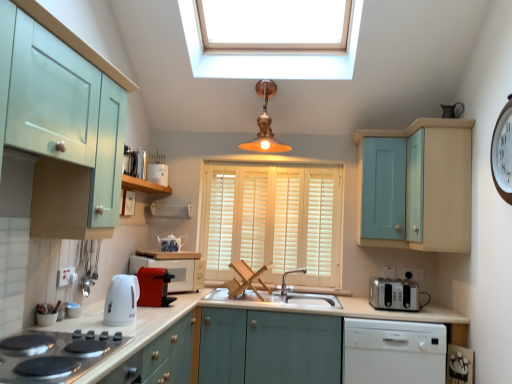
The width and height of the screenshot is (512, 384). I want to click on free space that is to the left of white glossy electric kettle at lower left, so click(x=84, y=321).